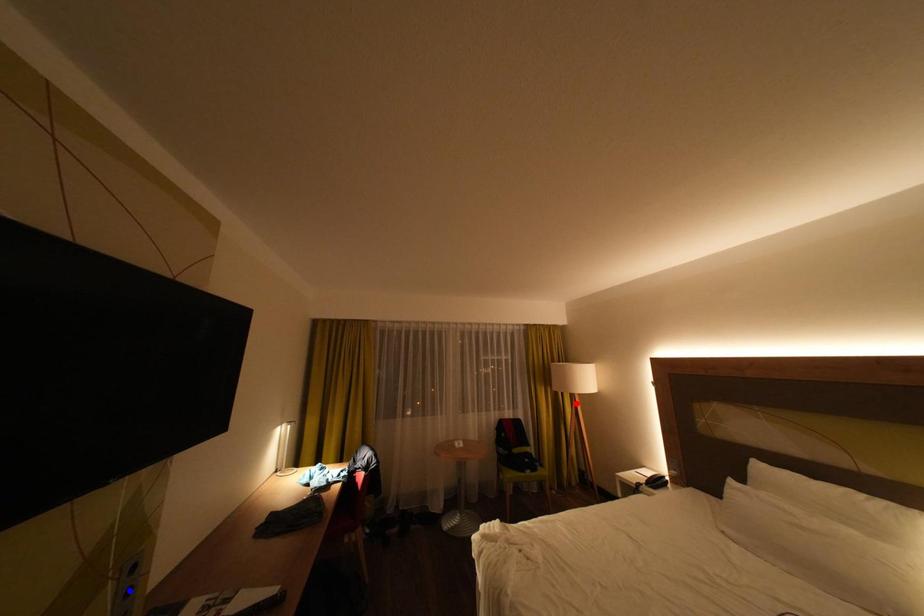
Question: Which of the two points in the image is closer to the camera?

Choices:
 (A) Blue point is closer.
 (B) Red point is closer.

Answer: (A)